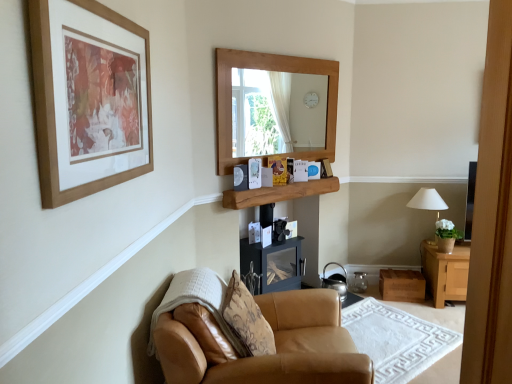
Question: Is tan leather armchair at lower center taller than shiny metallic kettle at lower center?

Choices:
 (A) no
 (B) yes

Answer: (A)

Question: Are tan leather armchair at lower center and shiny metallic kettle at lower center beside each other?

Choices:
 (A) no
 (B) yes

Answer: (A)

Question: Is tan leather armchair at lower center located outside shiny metallic kettle at lower center?

Choices:
 (A) no
 (B) yes

Answer: (B)

Question: Is tan leather armchair at lower center at the left side of shiny metallic kettle at lower center?

Choices:
 (A) yes
 (B) no

Answer: (B)

Question: Is tan leather armchair at lower center surrounding shiny metallic kettle at lower center?

Choices:
 (A) yes
 (B) no

Answer: (B)

Question: Based on their sizes in the image, would you say wooden shelf at center is bigger or smaller than leather armchair at lower left?

Choices:
 (A) small
 (B) big

Answer: (A)

Question: Is wooden shelf at center situated inside leather armchair at lower left or outside?

Choices:
 (A) outside
 (B) inside

Answer: (A)

Question: In terms of height, does wooden shelf at center look taller or shorter compared to leather armchair at lower left?

Choices:
 (A) short
 (B) tall

Answer: (A)

Question: From a real-world perspective, is wooden shelf at center above or below leather armchair at lower left?

Choices:
 (A) below
 (B) above

Answer: (B)

Question: In the image, is shiny metallic kettle at lower center positioned in front of or behind tan leather armchair at lower center?

Choices:
 (A) front
 (B) behind

Answer: (B)

Question: From their relative heights in the image, would you say shiny metallic kettle at lower center is taller or shorter than tan leather armchair at lower center?

Choices:
 (A) short
 (B) tall

Answer: (B)

Question: In the image, is shiny metallic kettle at lower center on the left side or the right side of tan leather armchair at lower center?

Choices:
 (A) left
 (B) right

Answer: (A)

Question: Looking at their shapes, would you say shiny metallic kettle at lower center is wider or thinner than tan leather armchair at lower center?

Choices:
 (A) thin
 (B) wide

Answer: (A)

Question: Is tan leather armchair at lower center taller or shorter than patterned fabric pillow at lower center?

Choices:
 (A) short
 (B) tall

Answer: (A)

Question: In terms of size, does tan leather armchair at lower center appear bigger or smaller than patterned fabric pillow at lower center?

Choices:
 (A) big
 (B) small

Answer: (B)